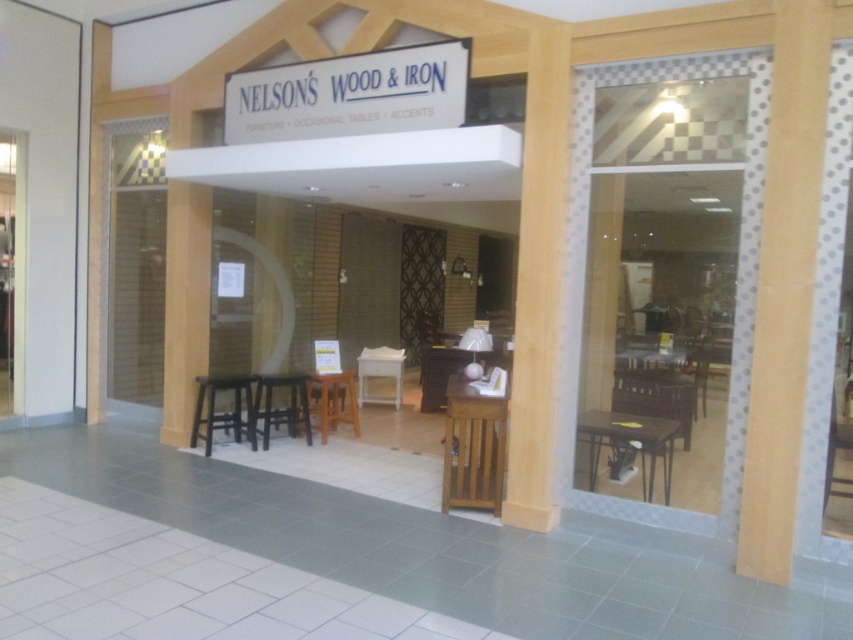
Measure the distance from matte white door at left to brown woven chair at center.

matte white door at left is 31.58 feet away from brown woven chair at center.

Does point (7, 388) lie in front of point (701, 340)?

That is True.

Find the location of a particular element. This screenshot has width=853, height=640. matte white door at left is located at coordinates (10, 269).

Between wooden at right and matte brown table at right, which one has less height?

With less height is matte brown table at right.

Which is in front, point (631, 381) or point (619, 432)?

Point (619, 432) is in front.

Is point (631, 397) positioned in front of point (642, 432)?

No, it is behind (642, 432).

The height and width of the screenshot is (640, 853). I want to click on wooden at right, so click(648, 422).

Between clear glass door at center and black wood stool at center, which one appears on the right side from the viewer's perspective?

clear glass door at center

Between point (569, 260) and point (254, 426), which one is positioned in front?

Positioned in front is point (569, 260).

Is point (618, 112) behind point (257, 384)?

No, (618, 112) is closer to viewer.

Image resolution: width=853 pixels, height=640 pixels. In order to click on clear glass door at center in this screenshot , I will do [663, 280].